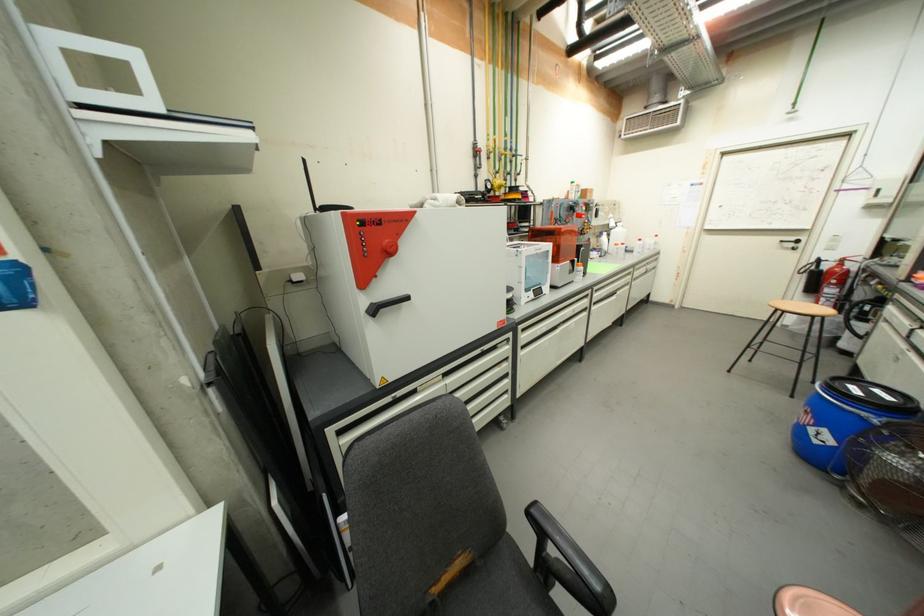
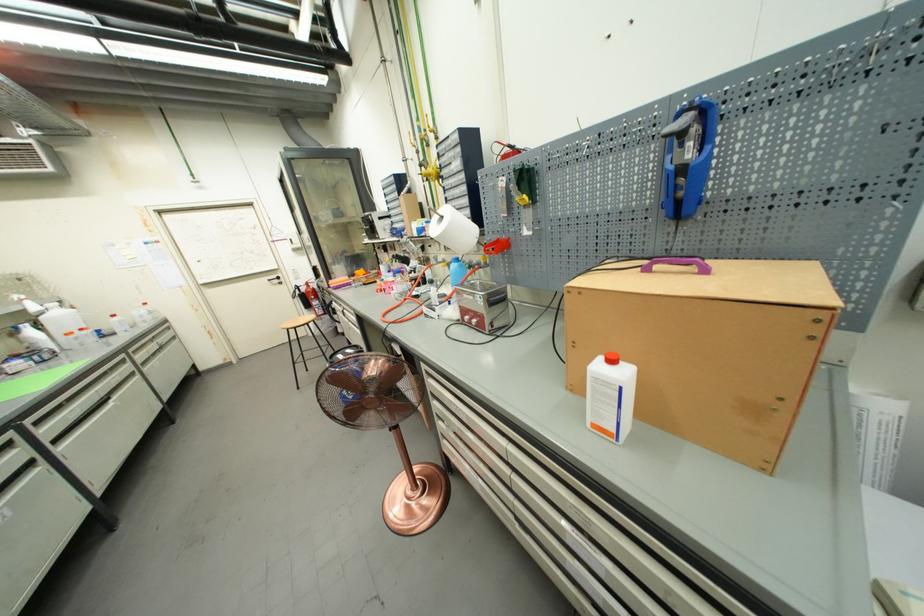
Where in the second image is the point corresponding to pixel 786 243 from the first image?

(274, 282)